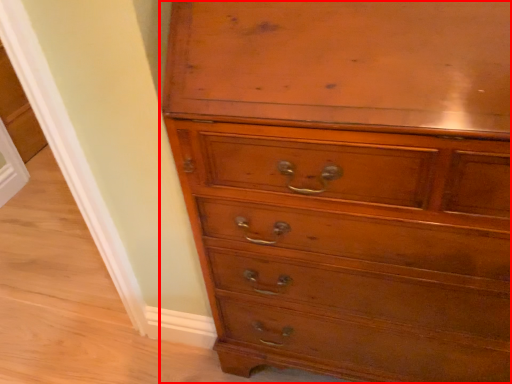
Question: From the image's perspective, where is chest of drawers (annotated by the red box) located in relation to screen door in the image?

Choices:
 (A) below
 (B) above

Answer: (A)